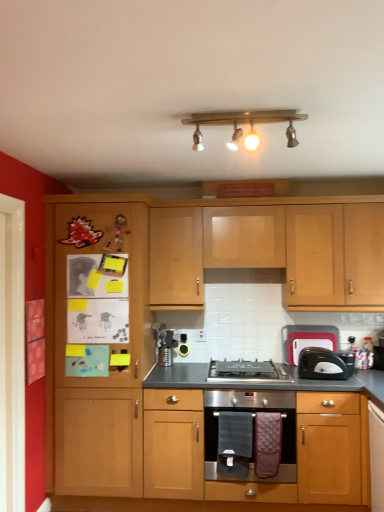
Question: Is black plastic toaster at right behind black plastic toaster at right?

Choices:
 (A) no
 (B) yes

Answer: (B)

Question: Is black plastic toaster at right looking in the opposite direction of black plastic toaster at right?

Choices:
 (A) yes
 (B) no

Answer: (B)

Question: Does black plastic toaster at right appear on the left side of black plastic toaster at right?

Choices:
 (A) no
 (B) yes

Answer: (A)

Question: From a real-world perspective, is black plastic toaster at right beneath black plastic toaster at right?

Choices:
 (A) no
 (B) yes

Answer: (A)

Question: Does black plastic toaster at right have a larger size compared to black plastic toaster at right?

Choices:
 (A) no
 (B) yes

Answer: (A)

Question: From the image's perspective, relative to wooden light fixture at upper center, is black plastic toaster at right above or below?

Choices:
 (A) below
 (B) above

Answer: (A)

Question: Looking at their shapes, would you say black plastic toaster at right is wider or thinner than wooden light fixture at upper center?

Choices:
 (A) thin
 (B) wide

Answer: (B)

Question: Relative to wooden light fixture at upper center, is black plastic toaster at right in front or behind?

Choices:
 (A) front
 (B) behind

Answer: (B)

Question: Does point (334, 360) appear closer or farther from the camera than point (274, 117)?

Choices:
 (A) farther
 (B) closer

Answer: (A)

Question: From the image's perspective, is stainless steel oven at center above or below stainless steel gas stove at center?

Choices:
 (A) above
 (B) below

Answer: (B)

Question: Looking at the image, does stainless steel oven at center seem bigger or smaller compared to stainless steel gas stove at center?

Choices:
 (A) big
 (B) small

Answer: (A)

Question: Choose the correct answer: Is stainless steel oven at center inside stainless steel gas stove at center or outside it?

Choices:
 (A) outside
 (B) inside

Answer: (A)

Question: From a real-world perspective, relative to stainless steel gas stove at center, is stainless steel oven at center vertically above or below?

Choices:
 (A) above
 (B) below

Answer: (B)

Question: From a real-world perspective, is wooden cabinet at left above or below matte wood oven at center, which is the 2th cabinetry in top-to-bottom order?

Choices:
 (A) above
 (B) below

Answer: (A)

Question: In the image, is wooden cabinet at left positioned in front of or behind matte wood oven at center, arranged as the first cabinetry when ordered from the bottom?

Choices:
 (A) behind
 (B) front

Answer: (A)